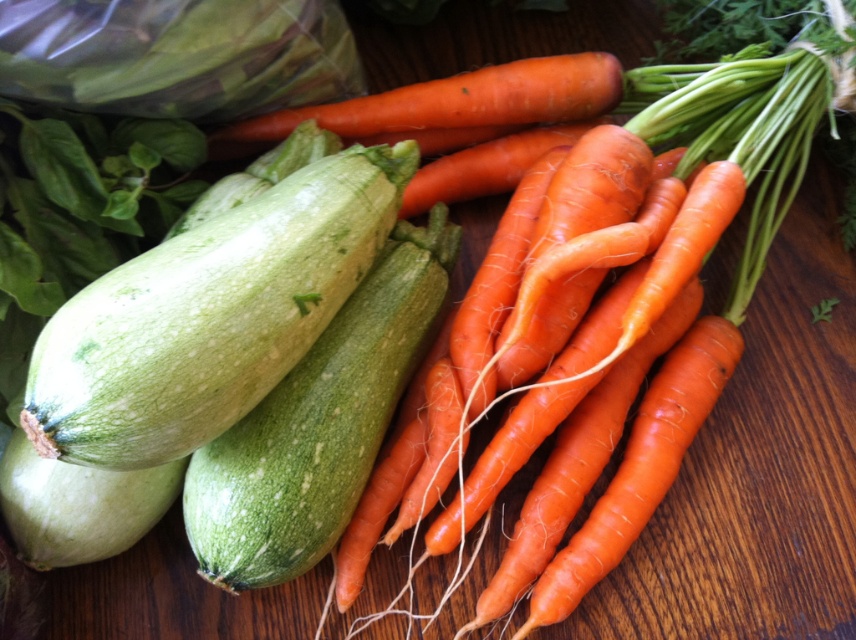
Question: Does green matte zucchini at left have a larger size compared to orange smooth carrot at center?

Choices:
 (A) yes
 (B) no

Answer: (B)

Question: Which object is farther from the camera taking this photo?

Choices:
 (A) orange matte carrot at center
 (B) green matte zucchini at left

Answer: (A)

Question: Does green matte zucchini at left come behind orange smooth carrot at center?

Choices:
 (A) no
 (B) yes

Answer: (A)

Question: Which point is farther to the camera?

Choices:
 (A) (384, 157)
 (B) (226, 140)
 (C) (654, 243)

Answer: (B)

Question: Considering the relative positions of orange smooth carrot at center and orange matte carrot at center in the image provided, where is orange smooth carrot at center located with respect to orange matte carrot at center?

Choices:
 (A) right
 (B) left

Answer: (A)

Question: Which object is closer to the camera taking this photo?

Choices:
 (A) orange matte carrot at center
 (B) green matte zucchini at left

Answer: (B)